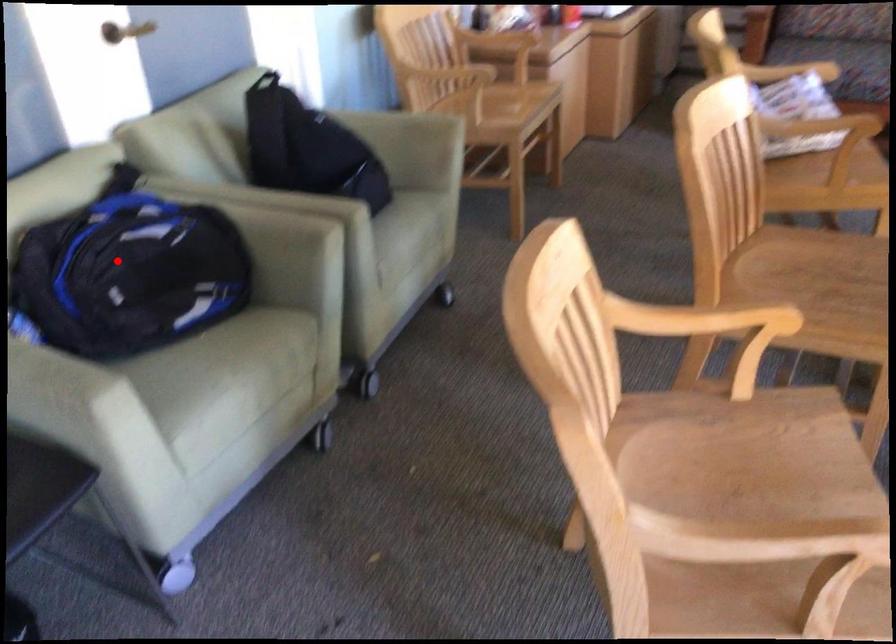
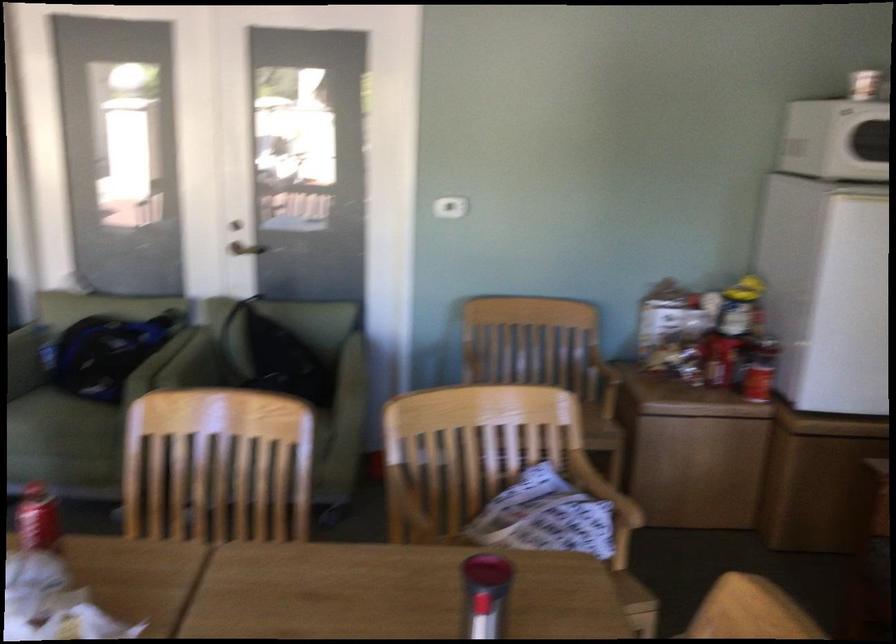
The point at the highlighted location is marked in the first image. Where is the corresponding point in the second image?

(104, 354)